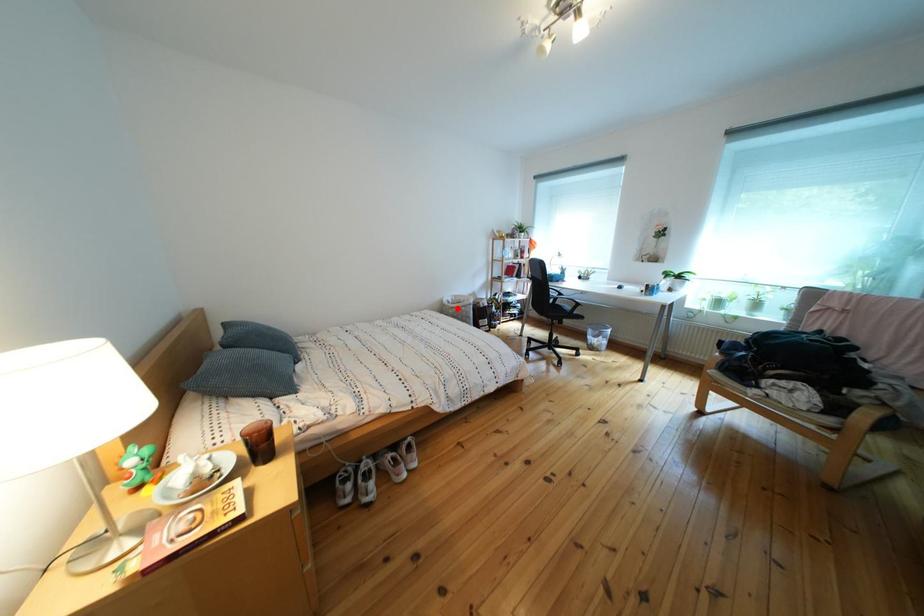
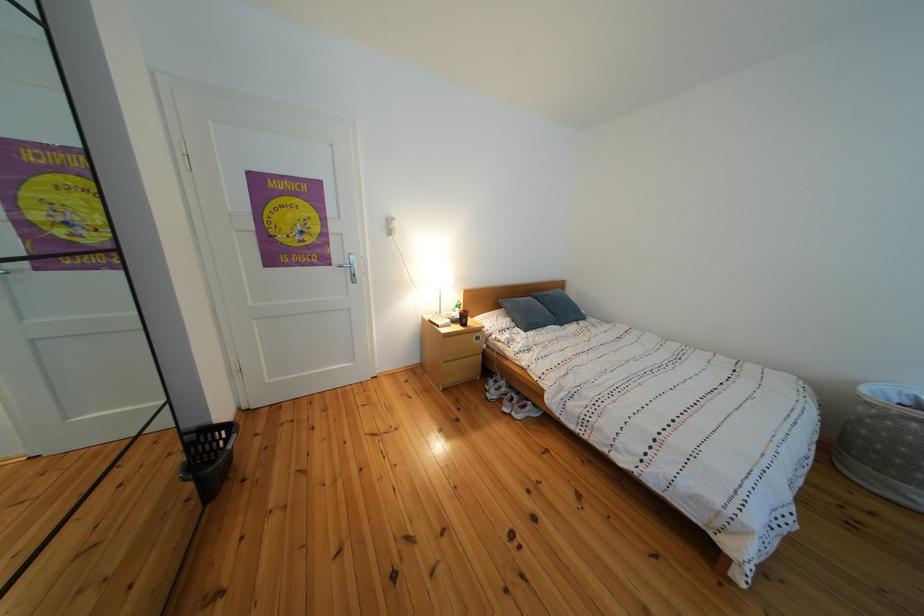
The point at the highlighted location is marked in the first image. Where is the corresponding point in the second image?

(890, 398)